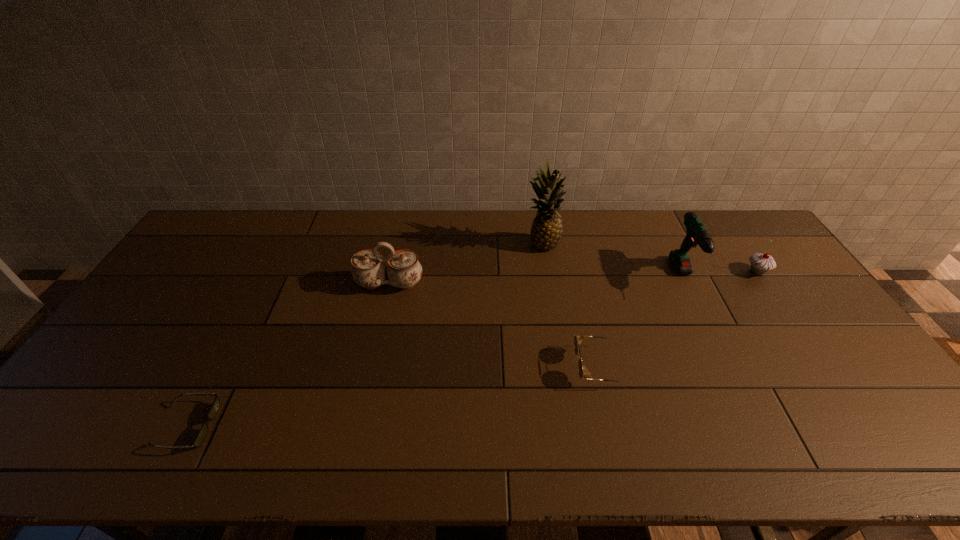
You are a GUI agent. You are given a task and a screenshot of the screen. Output one action in this format:
    pyautogui.click(x=<x>, y=<y>)
    Task: Click on the pineapple
    This screenshot has width=960, height=540.
    Given the screenshot: What is the action you would take?
    pyautogui.click(x=546, y=231)

I want to click on drill, so click(x=697, y=234).

Where is `the second object from right to left`? This screenshot has width=960, height=540. the second object from right to left is located at coordinates (697, 234).

Image resolution: width=960 pixels, height=540 pixels. In order to click on the second object from left to right in this screenshot , I will do `click(368, 270)`.

Identify the location of the third tallest object. (368, 270).

At what (x,y) coordinates should I click in order to perform the action: click on the rightmost object. Please return your answer as a coordinate pair (x, y). This screenshot has height=540, width=960. Looking at the image, I should click on (761, 263).

In order to click on cupcake in this screenshot , I will do `click(761, 263)`.

Locate an element on the screen. This screenshot has width=960, height=540. the second nearest object is located at coordinates (578, 339).

What are the coordinates of `the fifth tallest object` in the screenshot? It's located at (578, 339).

Find the location of a particular element. The width and height of the screenshot is (960, 540). the shorter sunglasses is located at coordinates (202, 433).